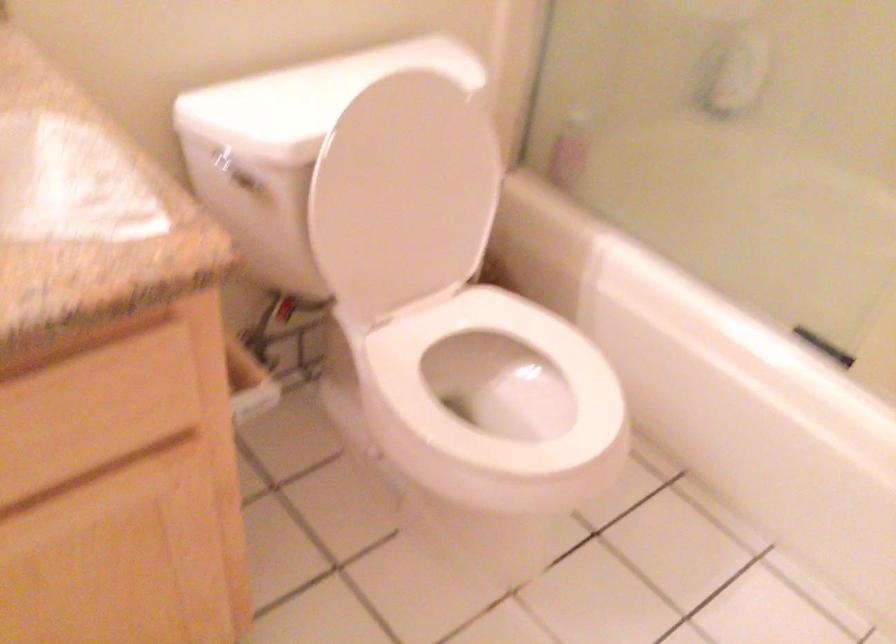
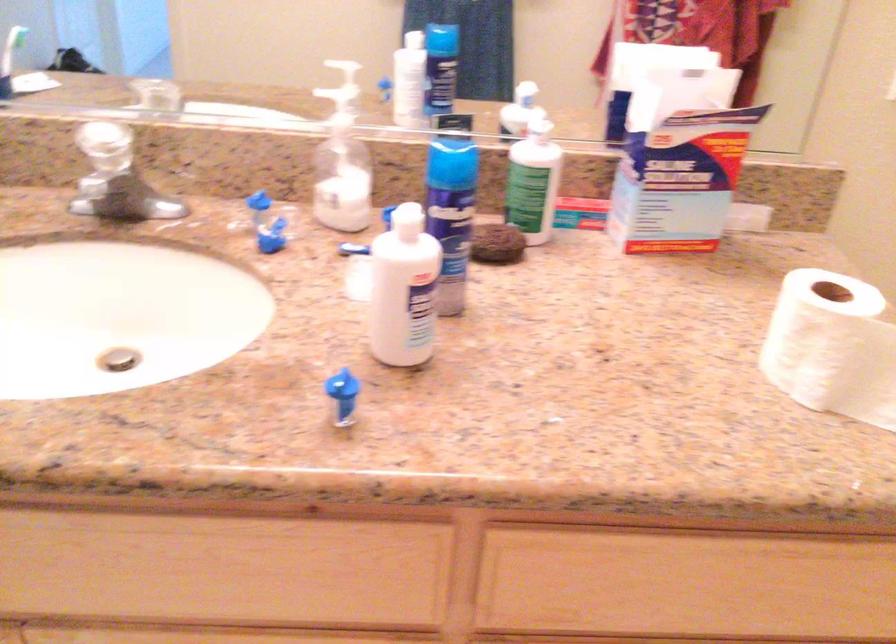
Question: The camera is either moving clockwise (left) or counter-clockwise (right) around the object. The first image is from the beginning of the video and the second image is from the end. Is the camera moving left or right when shooting the video?

Choices:
 (A) Left
 (B) Right

Answer: (B)